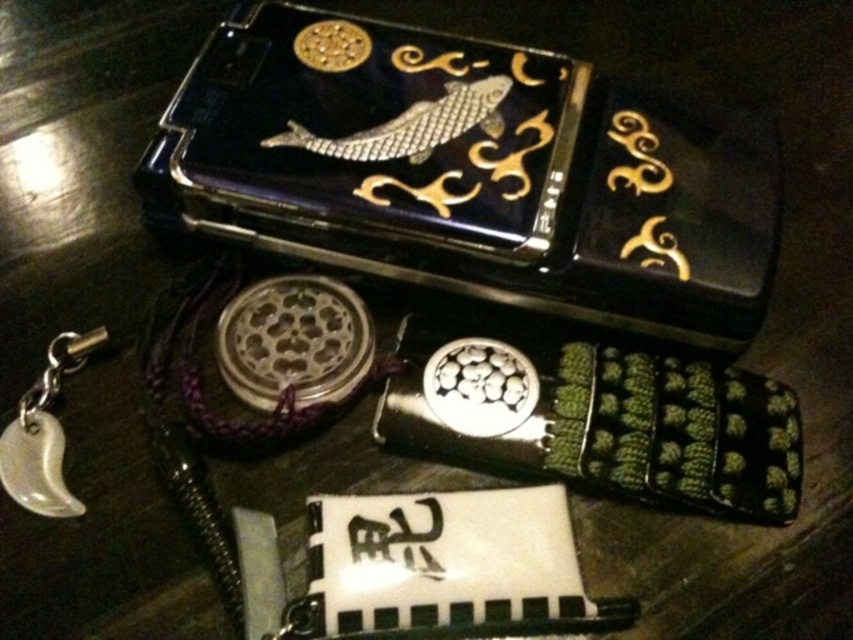
Question: Is black lacquer box at upper center smaller than white porcelain pocket watch at lower left?

Choices:
 (A) yes
 (B) no

Answer: (B)

Question: Can you confirm if black lacquer box at upper center is positioned above white porcelain pocket watch at lower left?

Choices:
 (A) yes
 (B) no

Answer: (A)

Question: From the image, what is the correct spatial relationship of black lacquer box at upper center in relation to white porcelain pocket watch at lower left?

Choices:
 (A) below
 (B) above

Answer: (B)

Question: Among these points, which one is nearest to the camera?

Choices:
 (A) (15, 419)
 (B) (225, 67)

Answer: (A)

Question: Among these objects, which one is nearest to the camera?

Choices:
 (A) white porcelain pocket watch at lower left
 (B) black lacquer box at upper center

Answer: (A)